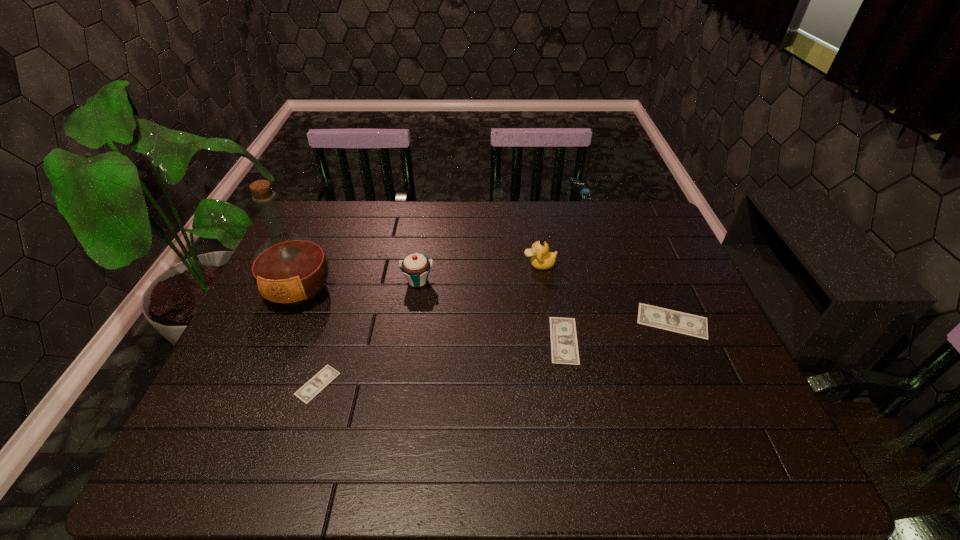
Where is `free space at the near edge of the desktop`? free space at the near edge of the desktop is located at coordinates (515, 391).

Locate an element on the screen. vacant region at the left edge of the desktop is located at coordinates (307, 326).

Find the location of a particular element. This screenshot has width=960, height=540. vacant area at the right edge is located at coordinates (669, 284).

Locate an element on the screen. free space at the far left corner of the desktop is located at coordinates (316, 207).

Locate an element on the screen. The height and width of the screenshot is (540, 960). vacant space that is in between the rightmost money and the duckling is located at coordinates (606, 293).

Find the location of a particular element. free point between the second money from right to left and the duckling is located at coordinates (552, 302).

Identify the location of free space between the second shortest object and the shortest object. (441, 362).

The width and height of the screenshot is (960, 540). In order to click on unoccupied position between the tallest object and the rightmost object in this screenshot , I will do `click(486, 306)`.

Locate an element on the screen. free area in between the second tallest money and the duckling is located at coordinates tap(552, 302).

This screenshot has width=960, height=540. I want to click on unoccupied area between the second money from right to left and the rightmost object, so click(x=618, y=330).